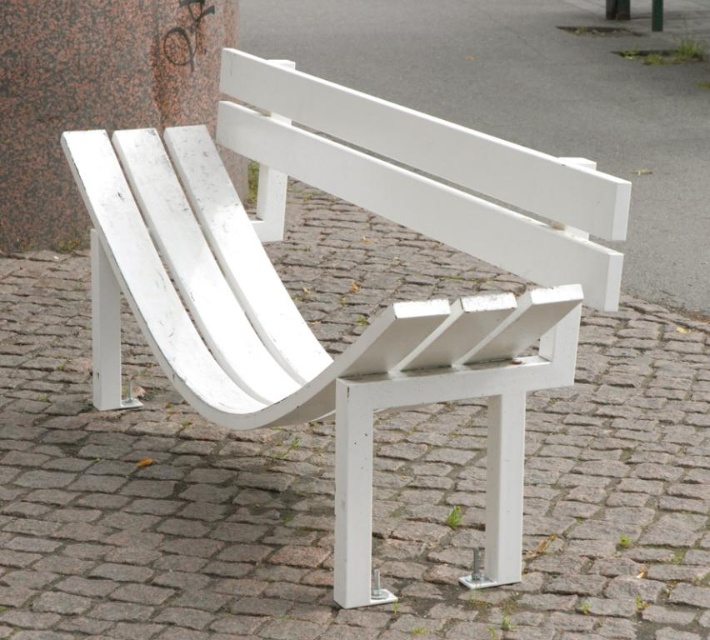
You are an architect designing a new outdoor space. You want to ensure that the white painted wood bench at center is positioned so it does not block the view of the smooth granite pillar at upper center from the main pathway. Based on their positions, is this arrangement feasible?

The white painted wood bench at center is located below the smooth granite pillar at upper center, so positioning it in a way that doesn not block the view of the pillar from the main pathway is feasible as long as the bench is placed lower or behind the pillar.

You are planning to place a small potted plant between the white painted wood bench at center and the smooth granite pillar at upper center. Considering their sizes, which object should the plant be closer to?

The white painted wood bench at center is larger in size than the smooth granite pillar at upper center, so the plant should be placed closer to the smooth granite pillar at upper center to maintain balance.